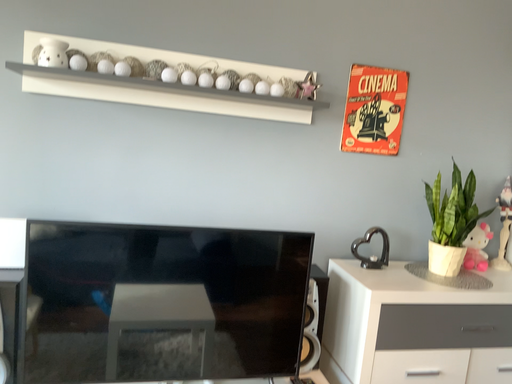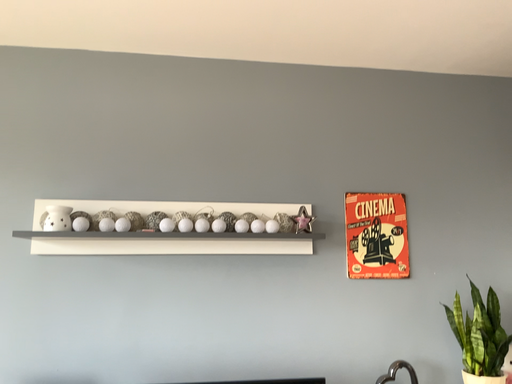
Question: How did the camera likely rotate when shooting the video?

Choices:
 (A) rotated upward
 (B) rotated downward

Answer: (A)